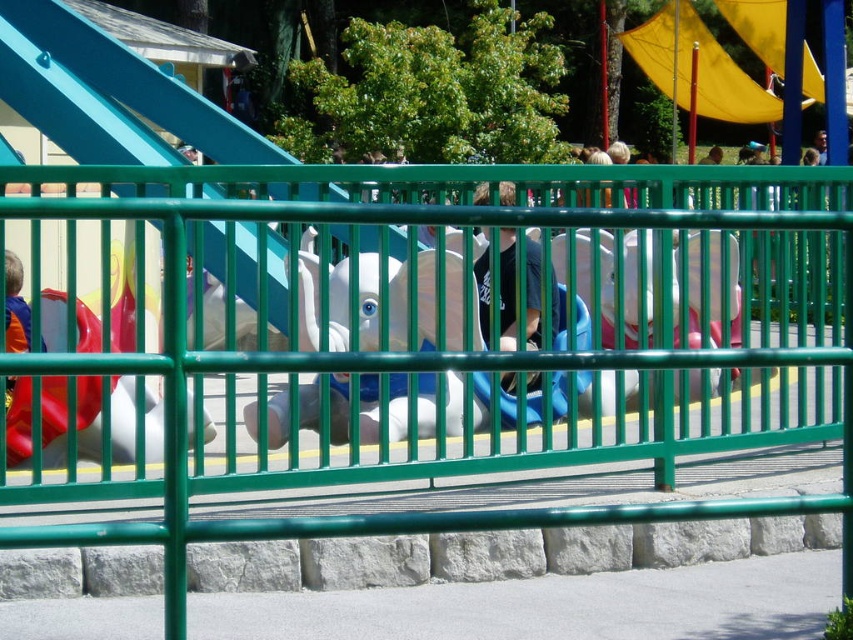
Can you confirm if white plastic elephant at center is positioned to the left of yellow fabric slide at upper center?

Correct, you'll find white plastic elephant at center to the left of yellow fabric slide at upper center.

Find the location of a particular element. Image resolution: width=853 pixels, height=640 pixels. white plastic elephant at center is located at coordinates (306, 301).

Identify the location of white plastic elephant at center. This screenshot has height=640, width=853. (306, 301).

Is green metal fence at center smaller than white plastic elephant at center?

No, green metal fence at center is not smaller than white plastic elephant at center.

Does green metal fence at center have a larger size compared to white plastic elephant at center?

Yes.

Locate an element on the screen. green metal fence at center is located at coordinates (473, 348).

Can you confirm if green metal fence at center is positioned above yellow fabric slide at upper center?

No, green metal fence at center is not above yellow fabric slide at upper center.

Is green metal fence at center shorter than yellow fabric slide at upper center?

Correct, green metal fence at center is not as tall as yellow fabric slide at upper center.

Where is `green metal fence at center`? green metal fence at center is located at coordinates (473, 348).